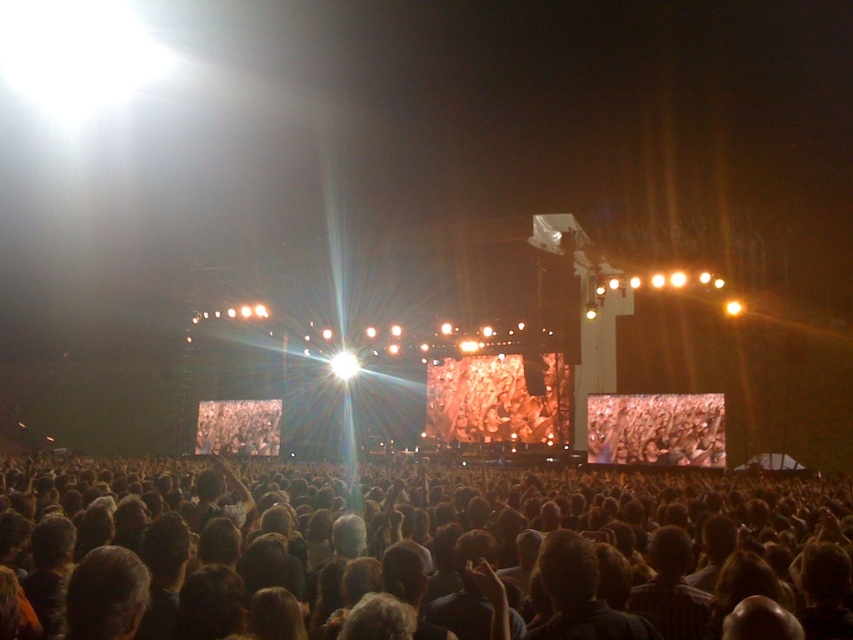
You are a photographer at the concert and want to capture a photo of the dark brown hair at center without the matte black crowd at center blocking it. Is this possible?

Yes, because the dark brown hair at center is closer to the viewer than the matte black crowd at center, so it can be framed to avoid the crowd blocking it.

You are a photographer at the concert and want to capture a photo that includes both the point at coordinates point (109, 560) and the point at coordinates point (646, 413). Which point should you focus on first to ensure both are in sharp focus?

You should focus on point (109, 560) first because it is closer to the camera, ensuring that both points will be in focus when using a shallow depth of field.

Please look at the point marked as point (415, 556). What is the color of the hair at that point?

The dark brown hair at center is represented by point (415, 556), so the color is dark brown.